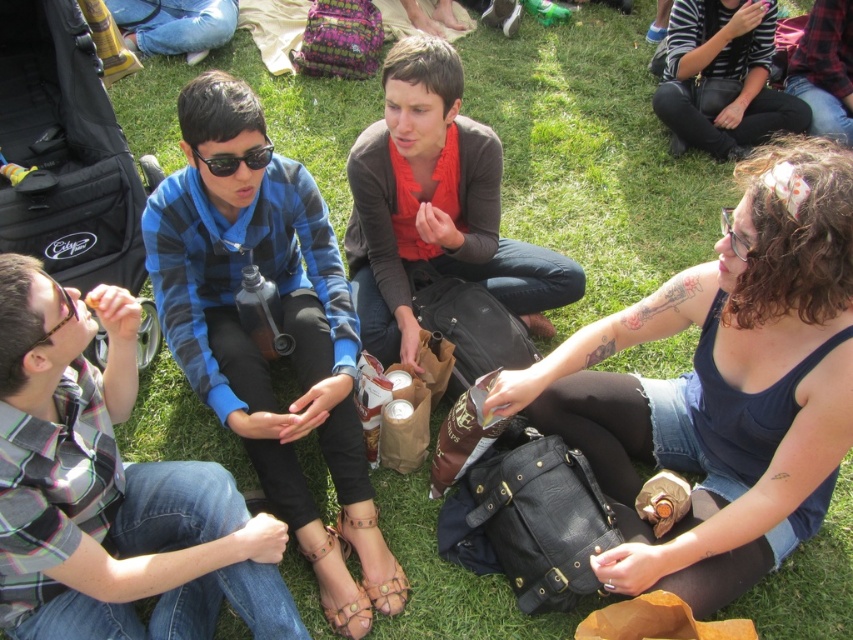
Between matte black tank top at lower right and striped knit sweater at upper right, which one appears on the right side from the viewer's perspective?

striped knit sweater at upper right

Who is more forward, (741, 481) or (711, 51)?

Point (741, 481)

The height and width of the screenshot is (640, 853). Identify the location of matte black tank top at lower right. (721, 387).

Does plaid shirt at left have a lesser height compared to blue plaid shirt at center?

Yes.

Is plaid shirt at left bigger than blue plaid shirt at center?

Incorrect, plaid shirt at left is not larger than blue plaid shirt at center.

Is point (204, 600) positioned after point (337, 612)?

No.

Image resolution: width=853 pixels, height=640 pixels. In order to click on plaid shirt at left in this screenshot , I will do `click(109, 490)`.

Can you confirm if striped knit sweater at upper right is positioned above brushed metal water bottle at upper left?

Incorrect, striped knit sweater at upper right is not positioned above brushed metal water bottle at upper left.

Does striped knit sweater at upper right come in front of brushed metal water bottle at upper left?

Yes, striped knit sweater at upper right is closer to the viewer.

Which is behind, point (730, 74) or point (201, 44)?

Positioned behind is point (201, 44).

Where is `striped knit sweater at upper right`? striped knit sweater at upper right is located at coordinates (723, 77).